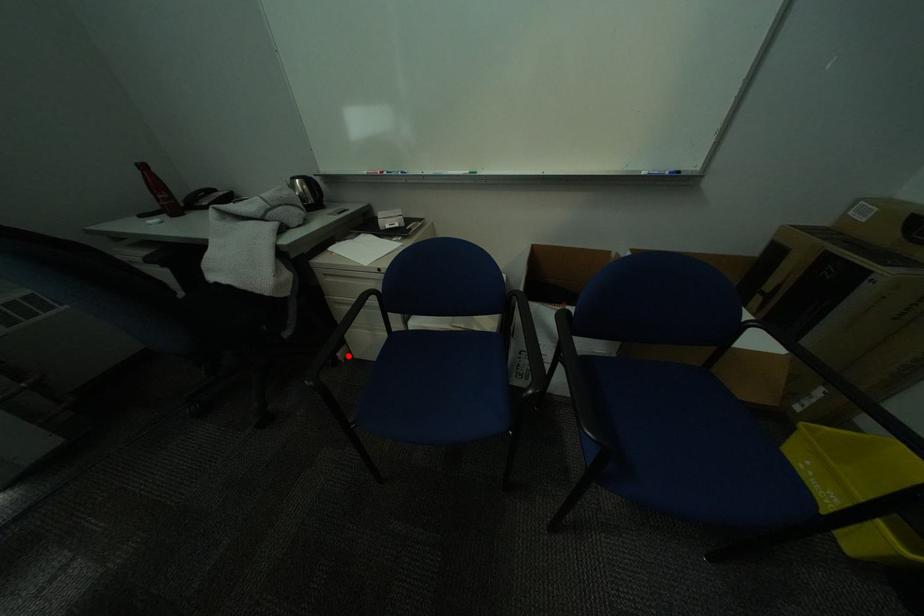
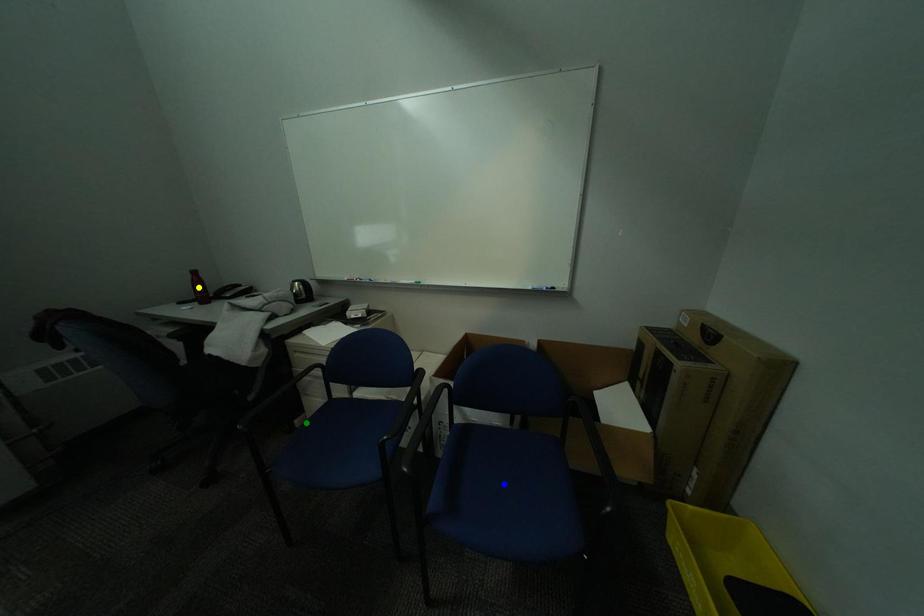
Question: I am providing you with two images of the same scene from different viewpoints. A red point is marked on the first image. You are given multiple points on the second image. Which mark in image 2 goes with the point in image 1?

Choices:
 (A) green point
 (B) yellow point
 (C) blue point

Answer: (A)